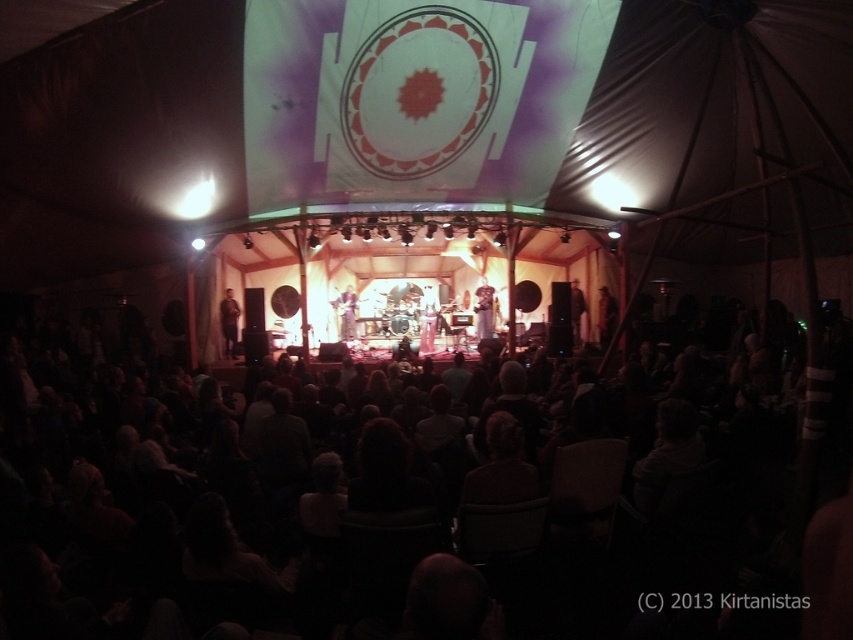
Measure the distance between point (228, 323) and camera.

They are 212.83 feet apart.

Between matte black guitar at left and silky white dress at center, which one appears on the left side from the viewer's perspective?

matte black guitar at left

Who is more forward, (228, 346) or (341, 326)?

Point (228, 346)

Where is `matte black guitar at left`? matte black guitar at left is located at coordinates (229, 323).

Between dark fabric chairs at center and matte black guitar at left, which one is positioned higher?

matte black guitar at left is higher up.

Who is positioned more to the right, dark fabric chairs at center or matte black guitar at left?

dark fabric chairs at center is more to the right.

The image size is (853, 640). Find the location of `dark fabric chairs at center`. dark fabric chairs at center is located at coordinates (345, 509).

Who is more forward, (x=71, y=374) or (x=350, y=289)?

Point (x=71, y=374) is more forward.

Consider the image. Does dark fabric chairs at center have a larger size compared to silky white dress at center?

Correct, dark fabric chairs at center is larger in size than silky white dress at center.

Who is more forward, (254, 493) or (339, 316)?

Point (254, 493) is more forward.

You are a GUI agent. You are given a task and a screenshot of the screen. Output one action in this format:
    pyautogui.click(x=<x>, y=<y>)
    Task: Click on the dark fabric chairs at center
    The image size is (853, 640).
    Given the screenshot: What is the action you would take?
    pyautogui.click(x=345, y=509)